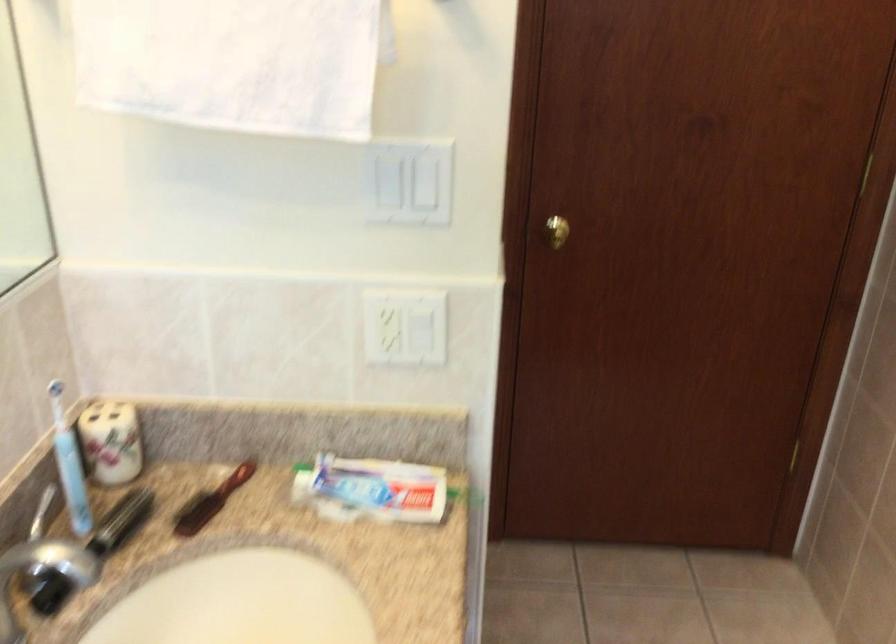
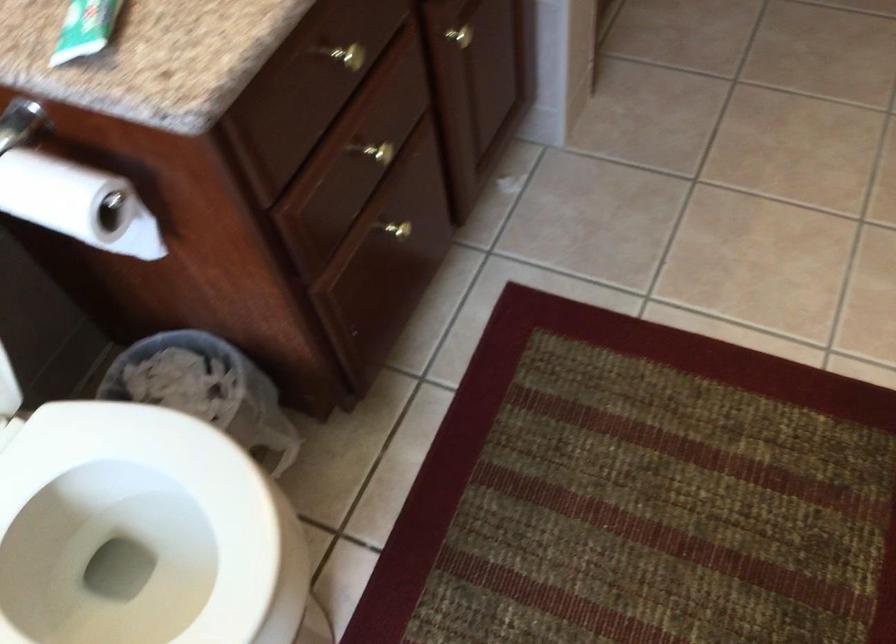
First-person continuous shooting, in which direction is the camera rotating?

The camera rotated toward left-down.